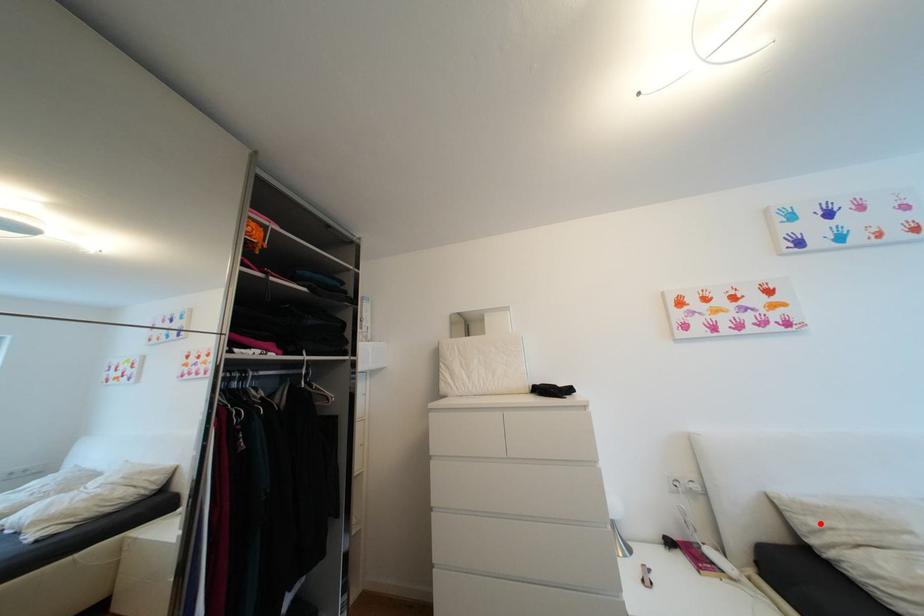
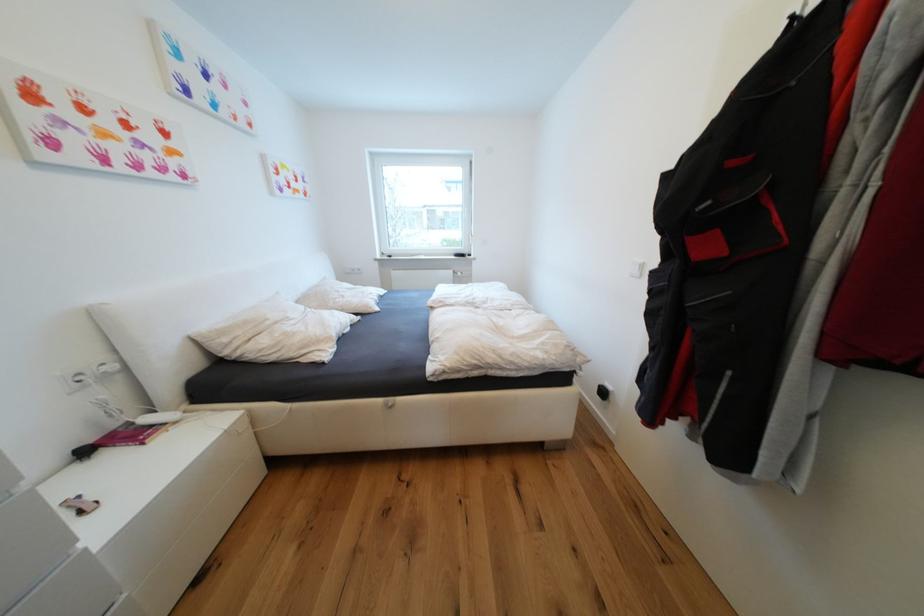
In the second image, find the point that corresponds to the highlighted location in the first image.

(233, 341)